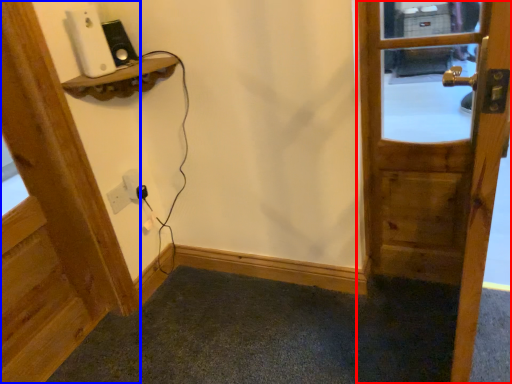
Question: Which object is closer to the camera taking this photo, door (highlighted by a red box) or door (highlighted by a blue box)?

Choices:
 (A) door
 (B) door

Answer: (A)